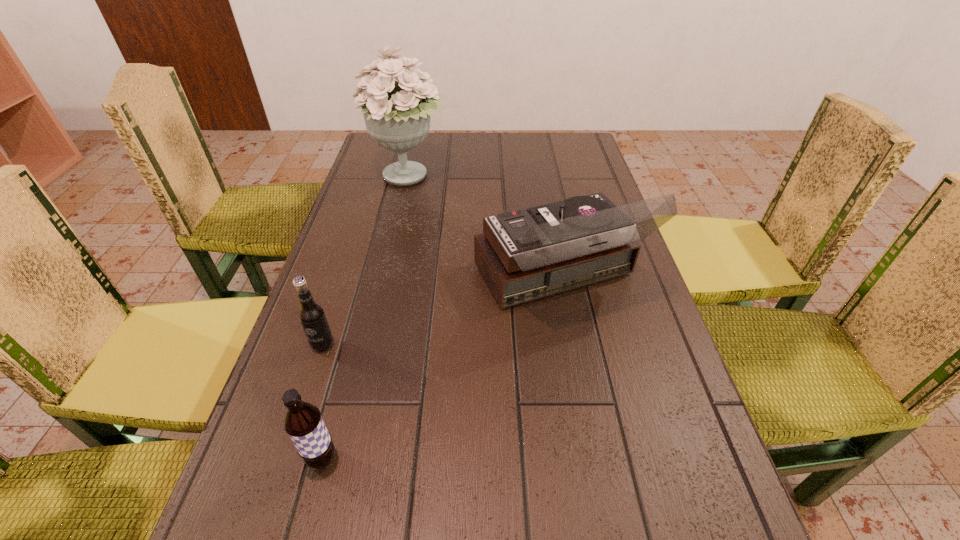
Image resolution: width=960 pixels, height=540 pixels. I want to click on object that is the closest to the nearest object, so click(x=311, y=315).

In order to click on object that can be found as the third closest to the record player in this screenshot , I will do `click(303, 423)`.

Where is `vacant space that satisfies the following two spatial constraints: 1. on the back side of the bouquet; 2. on the left side of the nearer root beer`? This screenshot has width=960, height=540. vacant space that satisfies the following two spatial constraints: 1. on the back side of the bouquet; 2. on the left side of the nearer root beer is located at coordinates pyautogui.click(x=396, y=177).

Find the location of a particular element. This screenshot has width=960, height=540. free spot that satisfies the following two spatial constraints: 1. on the label of the left root beer; 2. on the left side of the nearer root beer is located at coordinates (286, 458).

The width and height of the screenshot is (960, 540). I want to click on vacant point that satisfies the following two spatial constraints: 1. on the label of the nearer root beer; 2. on the right side of the left root beer, so click(286, 458).

Identify the location of vacant space that satisfies the following two spatial constraints: 1. on the front side of the bouquet; 2. on the left side of the third shortest object. The height and width of the screenshot is (540, 960). (386, 279).

What are the coordinates of `free space in the image that satisfies the following two spatial constraints: 1. on the label of the right root beer; 2. on the right side of the farther root beer` in the screenshot? It's located at (x=286, y=458).

In order to click on free space that satisfies the following two spatial constraints: 1. on the label of the nearest object; 2. on the left side of the left root beer in this screenshot , I will do `click(286, 458)`.

Where is `free space that satisfies the following two spatial constraints: 1. on the label of the nearest object; 2. on the left side of the farther root beer`? The height and width of the screenshot is (540, 960). free space that satisfies the following two spatial constraints: 1. on the label of the nearest object; 2. on the left side of the farther root beer is located at coordinates (286, 458).